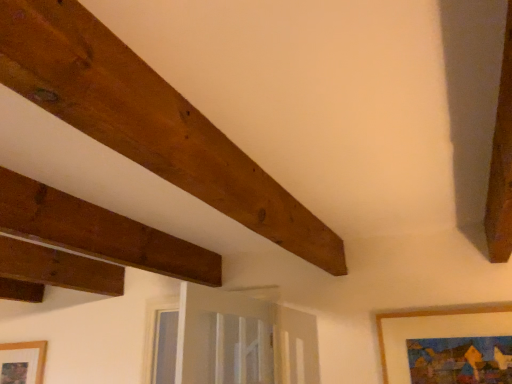
Question: From the image's perspective, is wooden picture frame at lower left, arranged as the 1th picture frame when viewed from the back, on wooden framed painting at lower right, the 2th picture frame in the left-to-right sequence?

Choices:
 (A) yes
 (B) no

Answer: (B)

Question: Considering the relative sizes of wooden picture frame at lower left, which appears as the first picture frame when ordered from the bottom, and wooden framed painting at lower right, the first picture frame when ordered from right to left, in the image provided, is wooden picture frame at lower left, which appears as the first picture frame when ordered from the bottom, thinner than wooden framed painting at lower right, the first picture frame when ordered from right to left,?

Choices:
 (A) yes
 (B) no

Answer: (A)

Question: Is wooden picture frame at lower left, the second picture frame in the top-to-bottom sequence, aimed at wooden framed painting at lower right, the 2th picture frame in the left-to-right sequence?

Choices:
 (A) yes
 (B) no

Answer: (B)

Question: Is wooden framed painting at lower right, the first picture frame when ordered from right to left, at the back of wooden picture frame at lower left, which appears as the first picture frame when ordered from the bottom?

Choices:
 (A) yes
 (B) no

Answer: (B)

Question: Does wooden picture frame at lower left, the second picture frame in the top-to-bottom sequence, come in front of wooden framed painting at lower right, marked as the first picture frame in a front-to-back arrangement?

Choices:
 (A) no
 (B) yes

Answer: (A)

Question: Is wooden picture frame at lower left, the first picture frame viewed from the left, positioned far away from wooden framed painting at lower right, the second picture frame when ordered from back to front?

Choices:
 (A) no
 (B) yes

Answer: (B)

Question: Does brown wooden plank at upper left lie in front of wooden picture frame at lower left, the first picture frame viewed from the left?

Choices:
 (A) no
 (B) yes

Answer: (B)

Question: Are brown wooden plank at upper left and wooden picture frame at lower left, which is the 2th picture frame in front-to-back order, making contact?

Choices:
 (A) no
 (B) yes

Answer: (A)

Question: Does brown wooden plank at upper left have a lesser height compared to wooden picture frame at lower left, which appears as the first picture frame when ordered from the bottom?

Choices:
 (A) yes
 (B) no

Answer: (A)

Question: Considering the relative sizes of brown wooden plank at upper left and wooden picture frame at lower left, which appears as the first picture frame when ordered from the bottom, in the image provided, is brown wooden plank at upper left taller than wooden picture frame at lower left, which appears as the first picture frame when ordered from the bottom,?

Choices:
 (A) yes
 (B) no

Answer: (B)

Question: From a real-world perspective, is brown wooden plank at upper left positioned over wooden picture frame at lower left, the first picture frame viewed from the left, based on gravity?

Choices:
 (A) no
 (B) yes

Answer: (B)

Question: From the image's perspective, is brown wooden plank at upper left located above wooden picture frame at lower left, which appears as the first picture frame when ordered from the bottom?

Choices:
 (A) yes
 (B) no

Answer: (A)

Question: Are brown wooden plank at upper left and wooden framed painting at lower right, the 2th picture frame in the left-to-right sequence, far apart?

Choices:
 (A) no
 (B) yes

Answer: (B)